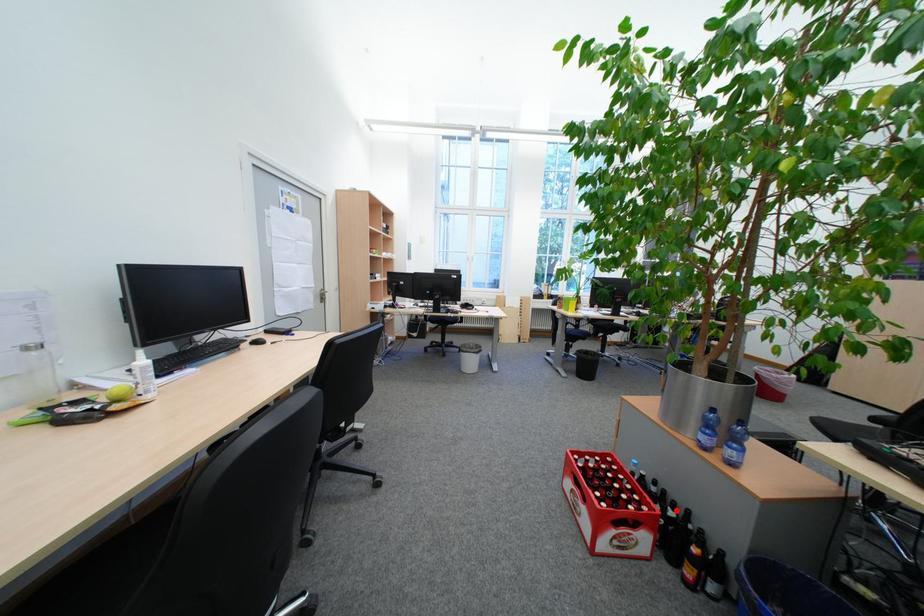
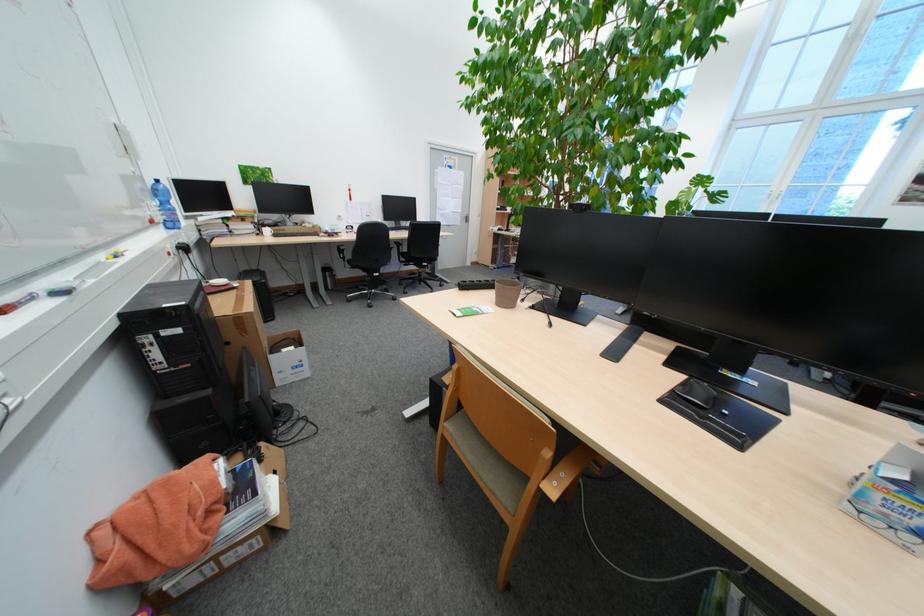
Question: I am providing you with two images of the same scene from different viewpoints. A red point is marked on the first image. At the location where the point appears in image 1, is it still visible in image 2?

Choices:
 (A) Yes
 (B) No

Answer: (B)